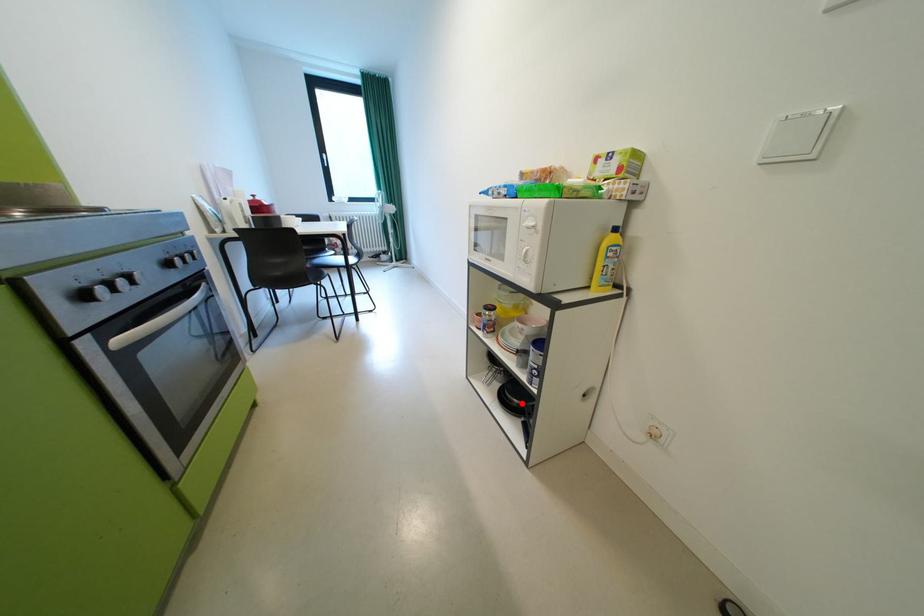
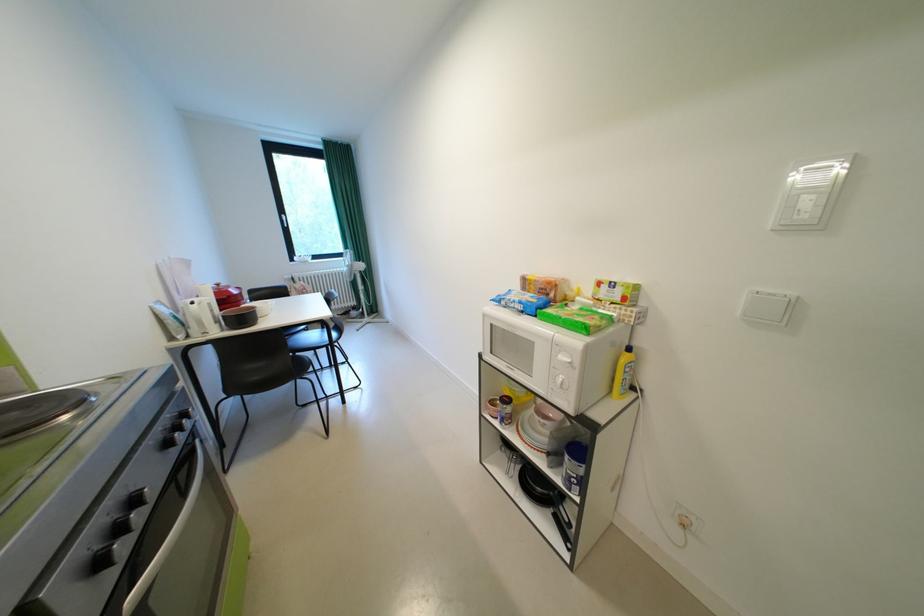
Where in the second image is the point corresponding to the highlighted location from the first image?

(544, 490)